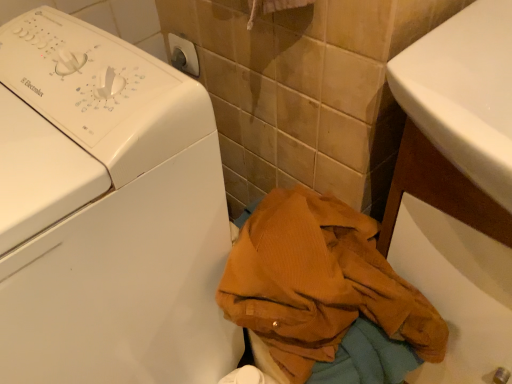
Question: Is corduroy fabric jacket at lower right closer to camera compared to white plastic washing machine at lower left?

Choices:
 (A) no
 (B) yes

Answer: (A)

Question: Is white plastic washing machine at lower left at the back of corduroy fabric jacket at lower right?

Choices:
 (A) no
 (B) yes

Answer: (A)

Question: From the image's perspective, would you say corduroy fabric jacket at lower right is positioned over white plastic washing machine at lower left?

Choices:
 (A) yes
 (B) no

Answer: (B)

Question: Can you confirm if corduroy fabric jacket at lower right is shorter than white plastic washing machine at lower left?

Choices:
 (A) no
 (B) yes

Answer: (B)

Question: Is the position of corduroy fabric jacket at lower right more distant than that of white plastic washing machine at lower left?

Choices:
 (A) no
 (B) yes

Answer: (B)

Question: Can you confirm if corduroy fabric jacket at lower right is wider than white plastic washing machine at lower left?

Choices:
 (A) yes
 (B) no

Answer: (B)

Question: Could you tell me if white plastic washing machine at lower left is turned towards corduroy fabric jacket at lower right?

Choices:
 (A) no
 (B) yes

Answer: (A)

Question: Does white plastic washing machine at lower left appear on the left side of corduroy fabric jacket at lower right?

Choices:
 (A) yes
 (B) no

Answer: (A)

Question: Would you consider white plastic washing machine at lower left to be distant from corduroy fabric jacket at lower right?

Choices:
 (A) yes
 (B) no

Answer: (B)

Question: Can you confirm if white plastic washing machine at lower left is smaller than corduroy fabric jacket at lower right?

Choices:
 (A) yes
 (B) no

Answer: (B)

Question: Does white plastic washing machine at lower left have a lesser width compared to corduroy fabric jacket at lower right?

Choices:
 (A) yes
 (B) no

Answer: (B)

Question: From a real-world perspective, does white plastic washing machine at lower left stand above corduroy fabric jacket at lower right?

Choices:
 (A) yes
 (B) no

Answer: (A)

Question: Relative to white plastic washing machine at lower left, is corduroy fabric jacket at lower right in front or behind?

Choices:
 (A) behind
 (B) front

Answer: (A)